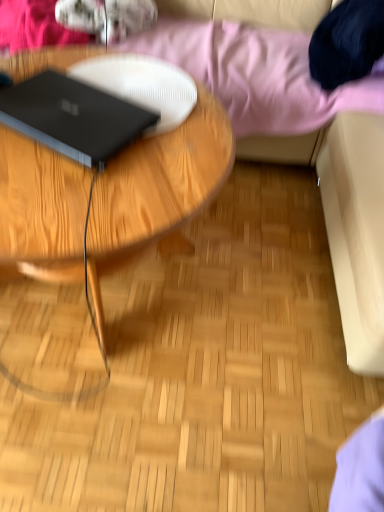
Question: Does pink fabric at upper center have a smaller size compared to wooden coffee table at center?

Choices:
 (A) yes
 (B) no

Answer: (B)

Question: Is pink fabric at upper center facing away from wooden coffee table at center?

Choices:
 (A) no
 (B) yes

Answer: (A)

Question: Would you say pink fabric at upper center is a long distance from wooden coffee table at center?

Choices:
 (A) no
 (B) yes

Answer: (A)

Question: Is pink fabric at upper center shorter than wooden coffee table at center?

Choices:
 (A) yes
 (B) no

Answer: (B)

Question: Does pink fabric at upper center lie behind wooden coffee table at center?

Choices:
 (A) no
 (B) yes

Answer: (B)

Question: Does point (153, 49) appear closer or farther from the camera than point (64, 276)?

Choices:
 (A) closer
 (B) farther

Answer: (B)

Question: From the image's perspective, relative to wooden coffee table at center, is pink fabric at upper center above or below?

Choices:
 (A) above
 (B) below

Answer: (A)

Question: Is pink fabric at upper center wider or thinner than wooden coffee table at center?

Choices:
 (A) wide
 (B) thin

Answer: (A)

Question: Is pink fabric at upper center bigger or smaller than wooden coffee table at center?

Choices:
 (A) small
 (B) big

Answer: (B)

Question: In the image, is wooden coffee table at center positioned in front of or behind black matte laptop at left?

Choices:
 (A) front
 (B) behind

Answer: (A)

Question: From the image's perspective, is wooden coffee table at center above or below black matte laptop at left?

Choices:
 (A) below
 (B) above

Answer: (A)

Question: From a real-world perspective, is wooden coffee table at center positioned above or below black matte laptop at left?

Choices:
 (A) above
 (B) below

Answer: (B)

Question: Does point (178, 165) appear closer or farther from the camera than point (39, 112)?

Choices:
 (A) closer
 (B) farther

Answer: (A)

Question: In terms of size, does black matte laptop at left appear bigger or smaller than pink fabric at upper center?

Choices:
 (A) big
 (B) small

Answer: (B)

Question: From a real-world perspective, is black matte laptop at left positioned above or below pink fabric at upper center?

Choices:
 (A) above
 (B) below

Answer: (A)